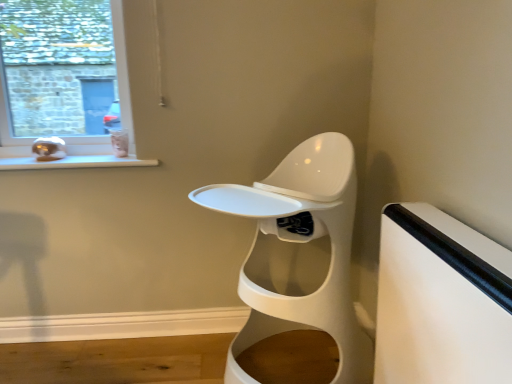
Question: Considering the relative sizes of white glossy toilet at center and matte glass window at upper left in the image provided, is white glossy toilet at center smaller than matte glass window at upper left?

Choices:
 (A) yes
 (B) no

Answer: (B)

Question: Is white glossy toilet at center at the right side of matte glass window at upper left?

Choices:
 (A) no
 (B) yes

Answer: (B)

Question: Is white glossy toilet at center thinner than matte glass window at upper left?

Choices:
 (A) no
 (B) yes

Answer: (A)

Question: Does white glossy toilet at center appear on the left side of matte glass window at upper left?

Choices:
 (A) no
 (B) yes

Answer: (A)

Question: From the image's perspective, is white glossy toilet at center over matte glass window at upper left?

Choices:
 (A) no
 (B) yes

Answer: (A)

Question: From a real-world perspective, is white glossy toilet at center on top of matte glass window at upper left?

Choices:
 (A) no
 (B) yes

Answer: (A)

Question: From a real-world perspective, is matte glass window at upper left positioned over white glossy window sill at lower left based on gravity?

Choices:
 (A) no
 (B) yes

Answer: (B)

Question: From the image's perspective, is matte glass window at upper left on top of white glossy window sill at lower left?

Choices:
 (A) no
 (B) yes

Answer: (B)

Question: Is white glossy window sill at lower left inside matte glass window at upper left?

Choices:
 (A) no
 (B) yes

Answer: (A)

Question: Is matte glass window at upper left next to white glossy window sill at lower left and touching it?

Choices:
 (A) yes
 (B) no

Answer: (B)

Question: Is matte glass window at upper left thinner than white glossy window sill at lower left?

Choices:
 (A) no
 (B) yes

Answer: (B)

Question: Is matte glass window at upper left shorter than white glossy window sill at lower left?

Choices:
 (A) no
 (B) yes

Answer: (A)

Question: Does white matte table at right appear on the left side of white glossy toilet at center?

Choices:
 (A) no
 (B) yes

Answer: (A)